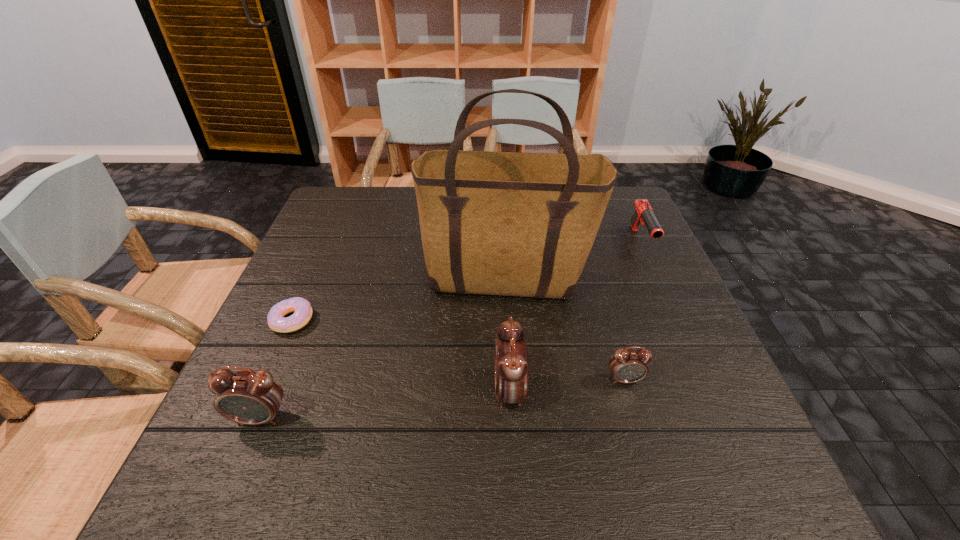
The image size is (960, 540). What are the coordinates of `blank space located 0.060m on the face of the rightmost alarm clock` in the screenshot? It's located at (635, 413).

At what (x,y) coordinates should I click in order to perform the action: click on free space located at the aiming end of the rightmost object. Please return your answer as a coordinate pair (x, y). Looking at the image, I should click on (657, 276).

Locate an element on the screen. vacant space located 0.130m on the back of the doughnut is located at coordinates (314, 269).

Locate an element on the screen. This screenshot has height=540, width=960. free location located on the left of the tote bag is located at coordinates (315, 282).

Identify the location of object at the far edge. (644, 213).

Find the location of `alarm clock located at the left edge`. alarm clock located at the left edge is located at coordinates (248, 397).

Locate an element on the screen. doughnut present at the left edge is located at coordinates (301, 307).

Locate an element on the screen. alarm clock at the right edge is located at coordinates (626, 366).

Locate an element on the screen. The width and height of the screenshot is (960, 540). gun located at the right edge is located at coordinates (644, 213).

Find the location of a particular element. object located at the near left corner is located at coordinates (248, 397).